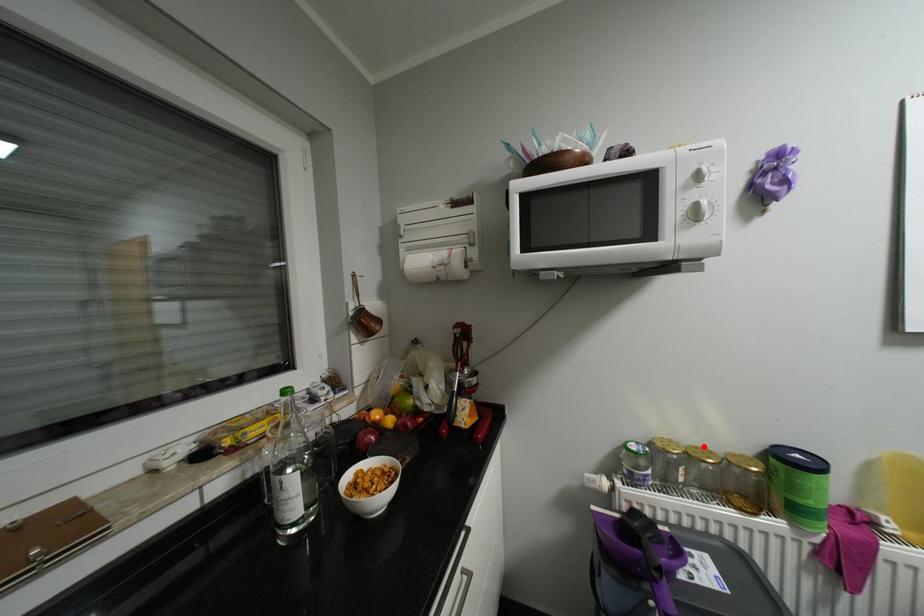
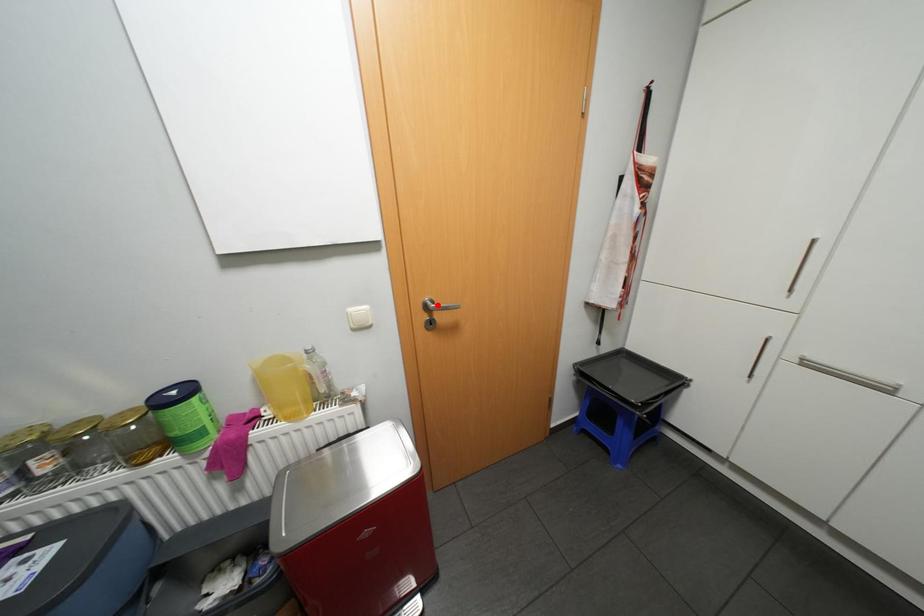
I am providing you with two images of the same scene from different viewpoints. A red point is marked on the first image and another point is marked on the second image. Is the red point in image1 aligned with the point shown in image2?

No